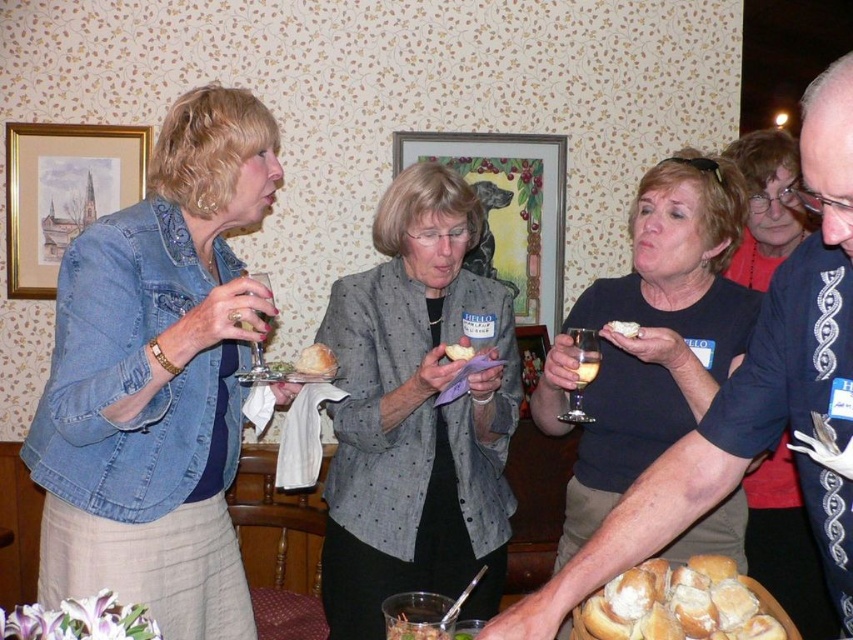
You are a photographer at the event and want to capture a photo of the white fluffy bread at lower center without the denim jacket at left blocking it. How can you adjust your position to ensure the bread is visible?

The denim jacket at left is taller than the white fluffy bread at lower center. To avoid blocking the bread, move to a lower angle or position yourself so the jacket is not directly in front of the bread.

You are at the gathering and want to grab a drink. The translucent glass at upper center is located at coordinates 0.575, 0.689. Can you estimate its position relative to the other objects in the scene?

The translucent glass at upper center is positioned at coordinates (587, 368), which places it near the center of the upper part of the scene.

You are at a party and want to grab a drink. You see the clear glass wine glass at upper left and the translucent glass at upper center. Which glass is closer to you?

The clear glass wine glass at upper left is positioned over the translucent glass at upper center, meaning it is closer to you.